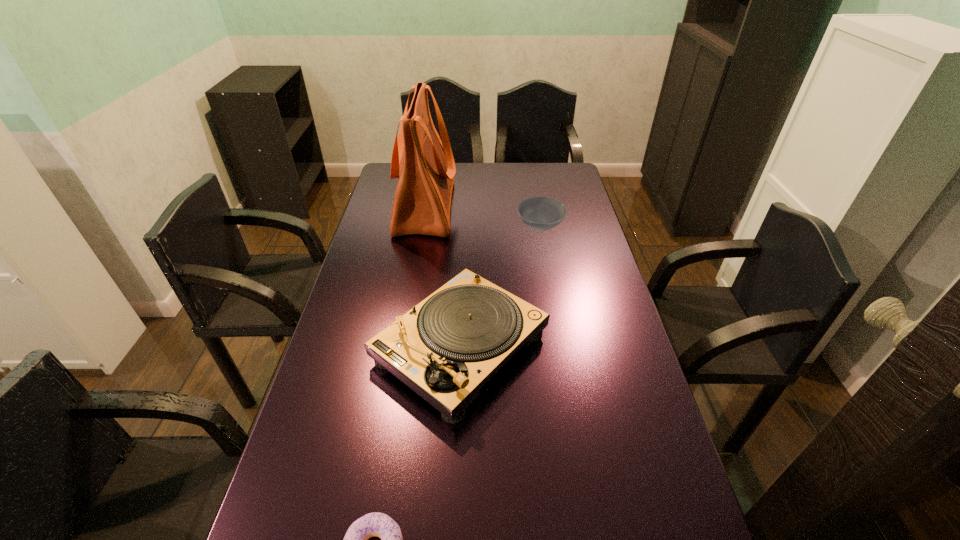
At what (x,y) coordinates should I click in order to perform the action: click on object that is the nearest to the shopping bag. Please return your answer as a coordinate pair (x, y). Looking at the image, I should click on (538, 213).

Locate an element on the screen. The image size is (960, 540). free location that satisfies the following two spatial constraints: 1. on the front pocket of the third shortest object; 2. on the right side of the shopping bag is located at coordinates (400, 347).

Locate an element on the screen. This screenshot has height=540, width=960. free space that satisfies the following two spatial constraints: 1. on the front pocket of the tallest object; 2. on the right side of the third farthest object is located at coordinates (400, 347).

This screenshot has height=540, width=960. I want to click on free region that satisfies the following two spatial constraints: 1. on the back side of the record player; 2. on the front pocket of the shopping bag, so click(467, 207).

This screenshot has height=540, width=960. Find the location of `free location that satisfies the following two spatial constraints: 1. on the back side of the second nearest object; 2. on the front pocket of the tallest object`. free location that satisfies the following two spatial constraints: 1. on the back side of the second nearest object; 2. on the front pocket of the tallest object is located at coordinates (467, 207).

The height and width of the screenshot is (540, 960). Identify the location of free point that satisfies the following two spatial constraints: 1. on the front pocket of the bowl; 2. on the left side of the tallest object. (421, 227).

In order to click on free space that satisfies the following two spatial constraints: 1. on the back side of the second nearest object; 2. on the front pocket of the shopping bag in this screenshot , I will do `click(467, 207)`.